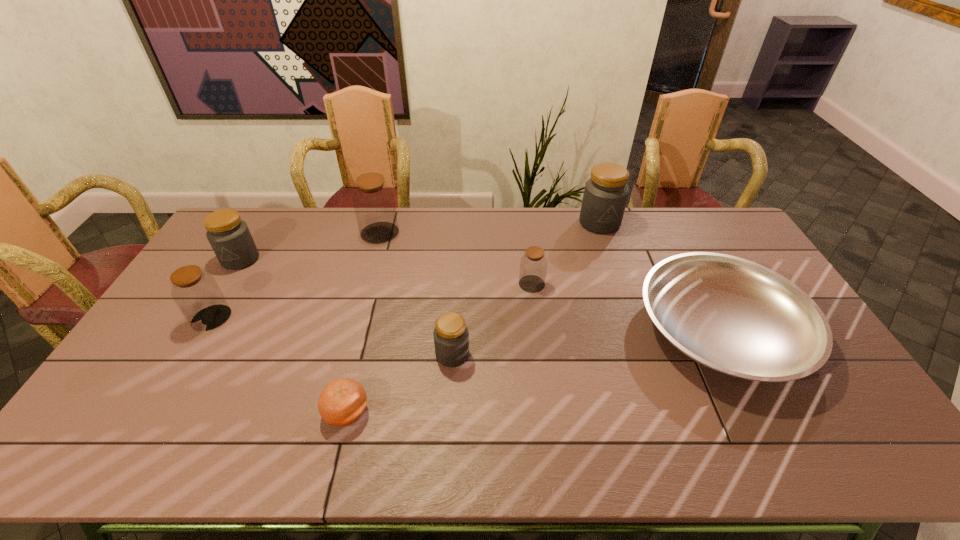
Locate an element on the screen. The width and height of the screenshot is (960, 540). free point between the bedpan and the third farthest jar is located at coordinates (480, 295).

Image resolution: width=960 pixels, height=540 pixels. In order to click on free spot between the second smallest gray jar and the farthest brown jar in this screenshot , I will do `click(310, 246)`.

Where is `empty location between the farthest gray jar and the rightmost brown jar`? empty location between the farthest gray jar and the rightmost brown jar is located at coordinates (565, 253).

At what (x,y) coordinates should I click in order to perform the action: click on vacant space that is in between the fifth farthest jar and the rightmost jar. Please return your answer as a coordinate pair (x, y). The width and height of the screenshot is (960, 540). Looking at the image, I should click on (405, 271).

You are a GUI agent. You are given a task and a screenshot of the screen. Output one action in this format:
    pyautogui.click(x=<x>, y=<y>)
    Task: Click on the free space between the second farthest gray jar and the nearest brown jar
    
    Given the screenshot: What is the action you would take?
    pyautogui.click(x=226, y=288)

The height and width of the screenshot is (540, 960). I want to click on free spot between the bedpan and the clementine, so click(x=534, y=371).

Locate an element on the screen. The width and height of the screenshot is (960, 540). vacant space that's between the fifth farthest jar and the nearest gray jar is located at coordinates (332, 336).

The width and height of the screenshot is (960, 540). Find the location of `free space that is in between the second smallest gray jar and the second nearest jar`. free space that is in between the second smallest gray jar and the second nearest jar is located at coordinates (226, 288).

Point out which object is positioned as the second nearest to the clementine. Please provide its 2D coordinates. Your answer should be formatted as a tuple, i.e. [(x, y)], where the tuple contains the x and y coordinates of a point satisfying the conditions above.

[(198, 296)]

Identify which object is located as the fourth nearest to the rightmost jar. Please provide its 2D coordinates. Your answer should be formatted as a tuple, i.e. [(x, y)], where the tuple contains the x and y coordinates of a point satisfying the conditions above.

[(374, 204)]